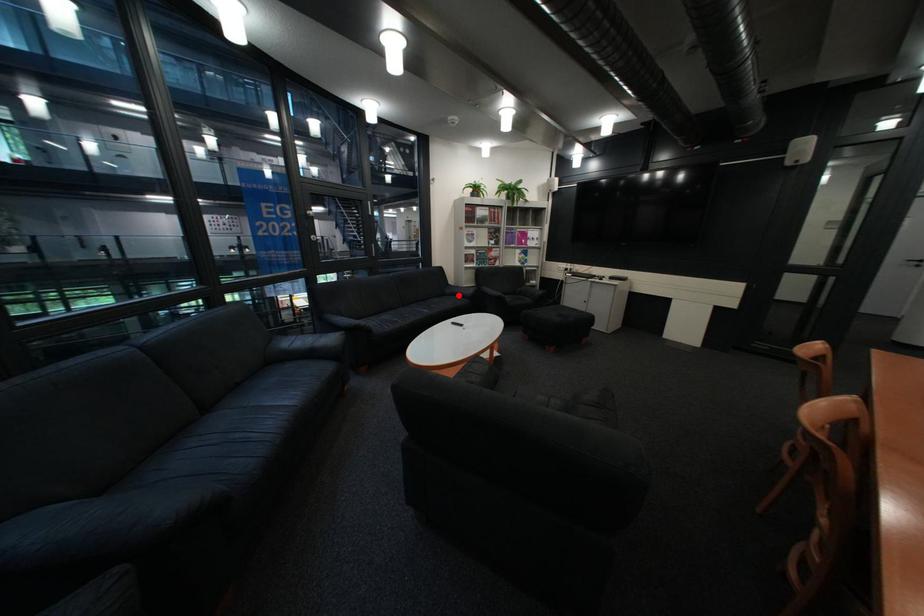
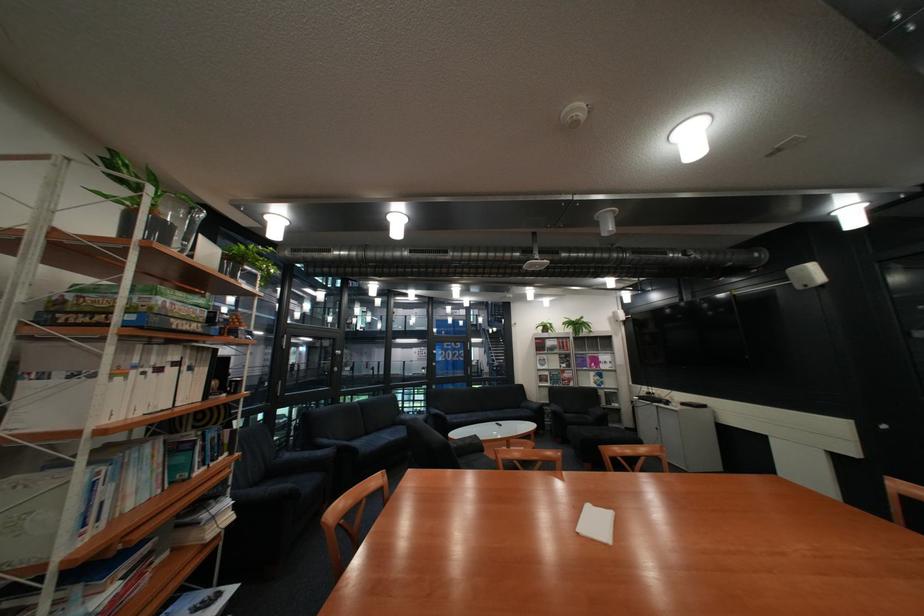
The point at the highlighted location is marked in the first image. Where is the corresponding point in the second image?

(535, 408)